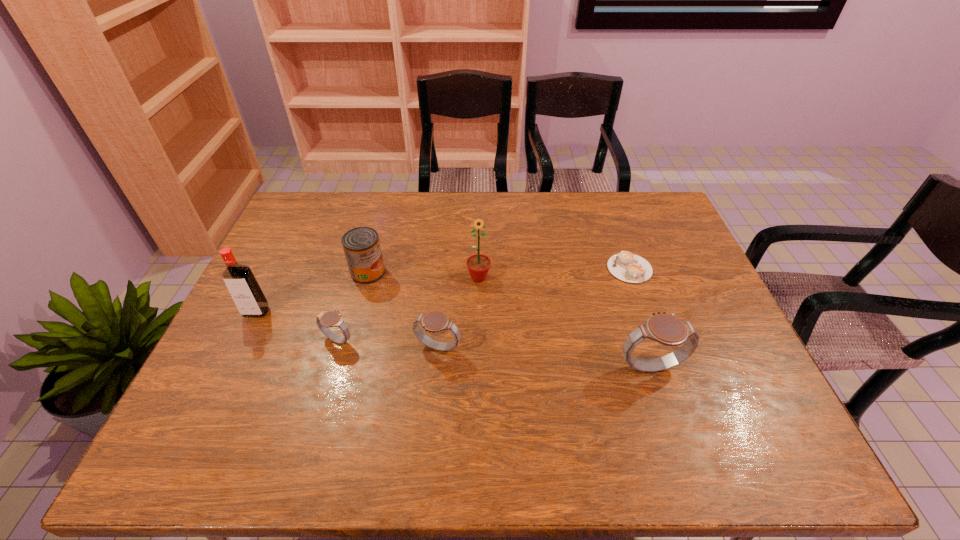
At what (x,y) coordinates should I click in order to perform the action: click on vacant space that is in between the can and the third object from right to left. Please return your answer as a coordinate pair (x, y). Looking at the image, I should click on (423, 275).

Where is `free space between the leftmost watch and the shortest object`? The height and width of the screenshot is (540, 960). free space between the leftmost watch and the shortest object is located at coordinates (484, 305).

At what (x,y) coordinates should I click in order to perform the action: click on vacant space that is in between the shortest watch and the fourth farthest object. Please return your answer as a coordinate pair (x, y). Looking at the image, I should click on (297, 326).

I want to click on free point between the third object from right to left and the fourth nearest object, so click(368, 295).

Where is `vacant space that's between the can and the leftmost watch`? This screenshot has height=540, width=960. vacant space that's between the can and the leftmost watch is located at coordinates (352, 306).

Identify the location of free point between the sixth tallest object and the fourth object from right to left. The height and width of the screenshot is (540, 960). (388, 345).

The image size is (960, 540). Find the location of `free space between the fourth nearest object and the third object from right to left`. free space between the fourth nearest object and the third object from right to left is located at coordinates (368, 295).

Locate which object is the third closest to the leftmost watch. Please provide its 2D coordinates. Your answer should be formatted as a tuple, i.e. [(x, y)], where the tuple contains the x and y coordinates of a point satisfying the conditions above.

[(361, 245)]

The image size is (960, 540). I want to click on the closest object relative to the sixth tallest object, so click(x=435, y=321).

Point out which watch is positioned as the nearest to the can. Please provide its 2D coordinates. Your answer should be formatted as a tuple, i.e. [(x, y)], where the tuple contains the x and y coordinates of a point satisfying the conditions above.

[(324, 320)]